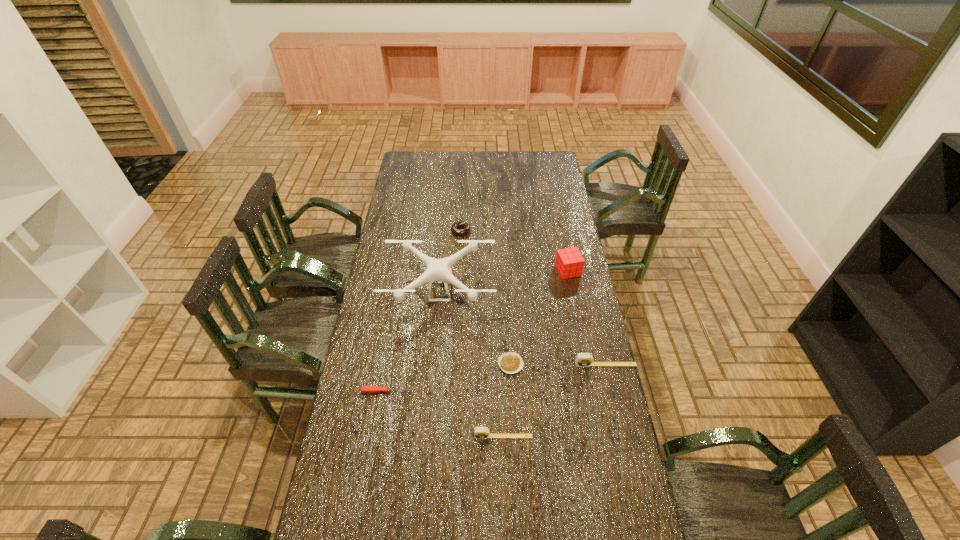
You are a GUI agent. You are given a task and a screenshot of the screen. Output one action in this format:
    pyautogui.click(x=<x>, y=<y>)
    Task: Click on the nearer tape measure
    The width and height of the screenshot is (960, 540).
    Given the screenshot: What is the action you would take?
    click(479, 432)

Image resolution: width=960 pixels, height=540 pixels. In order to click on the nearest object in this screenshot , I will do `click(479, 432)`.

Where is `the taller tape measure`? The height and width of the screenshot is (540, 960). the taller tape measure is located at coordinates (582, 359).

This screenshot has width=960, height=540. Identify the location of the farther tape measure. (582, 359).

At what (x,y) coordinates should I click in order to perform the action: click on the third shortest object. Please return your answer as a coordinate pair (x, y). The image size is (960, 540). Looking at the image, I should click on (460, 224).

Identify the location of the farthest object. (460, 224).

Identify the location of cube. (569, 262).

Locate an element on the screen. The image size is (960, 540). legume is located at coordinates (511, 362).

You are a GUI agent. You are given a task and a screenshot of the screen. Output one action in this format:
    pyautogui.click(x=<x>, y=<y>)
    Task: Click on the sixth farthest object
    The width and height of the screenshot is (960, 540).
    Given the screenshot: What is the action you would take?
    pyautogui.click(x=364, y=389)

Image resolution: width=960 pixels, height=540 pixels. I want to click on the second shortest object, so click(364, 389).